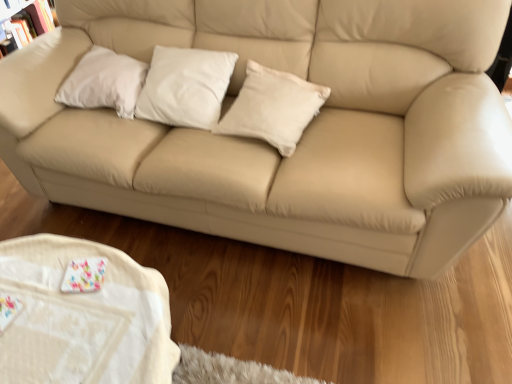
Where is `free space above white fabric table at lower left (from a real-world perspective)`? free space above white fabric table at lower left (from a real-world perspective) is located at coordinates (71, 299).